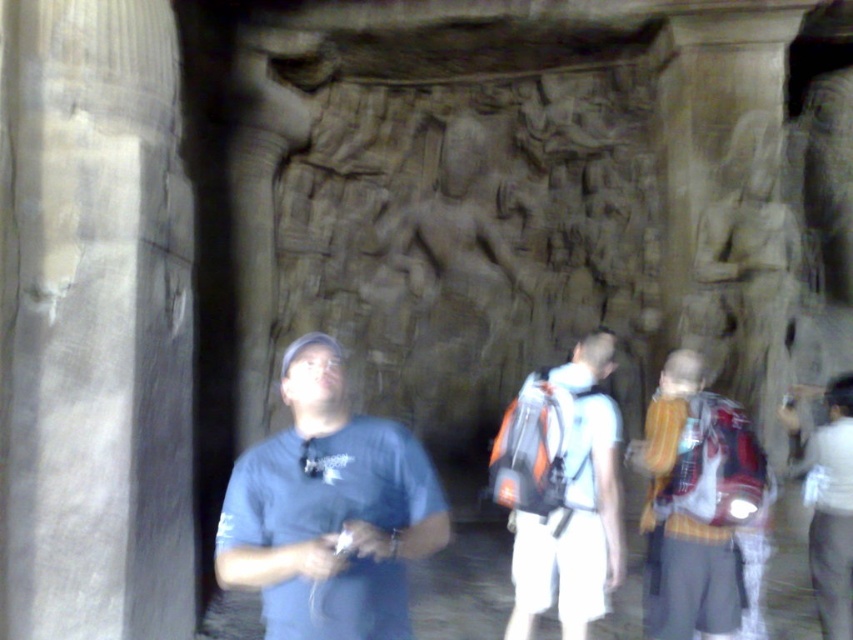
You are a tour guide explaining the dimensions of the pillars and clothing items in the scene. Which object is wider, the white marble pillar at left or the white cotton shirt at center?

The white marble pillar at left is wider than the white cotton shirt at center according to the description.

You are a tour guide at this historical site. You need to explain the size relationship between the white marble pillar at left and the white cotton shirt at center to your visitors. What do you tell them?

The white marble pillar at left is larger in size compared to the white cotton shirt at center.